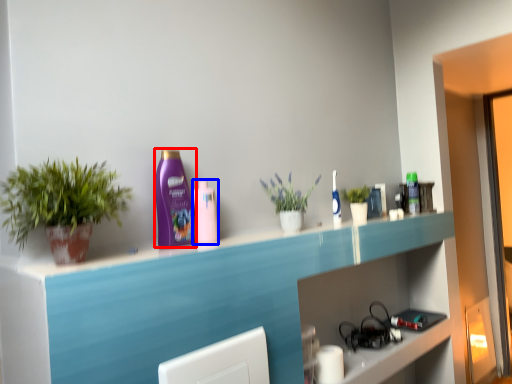
Question: Which point is further to the camera, cleaning product (highlighted by a red box) or mouthwash (highlighted by a blue box)?

Choices:
 (A) cleaning product
 (B) mouthwash

Answer: (B)